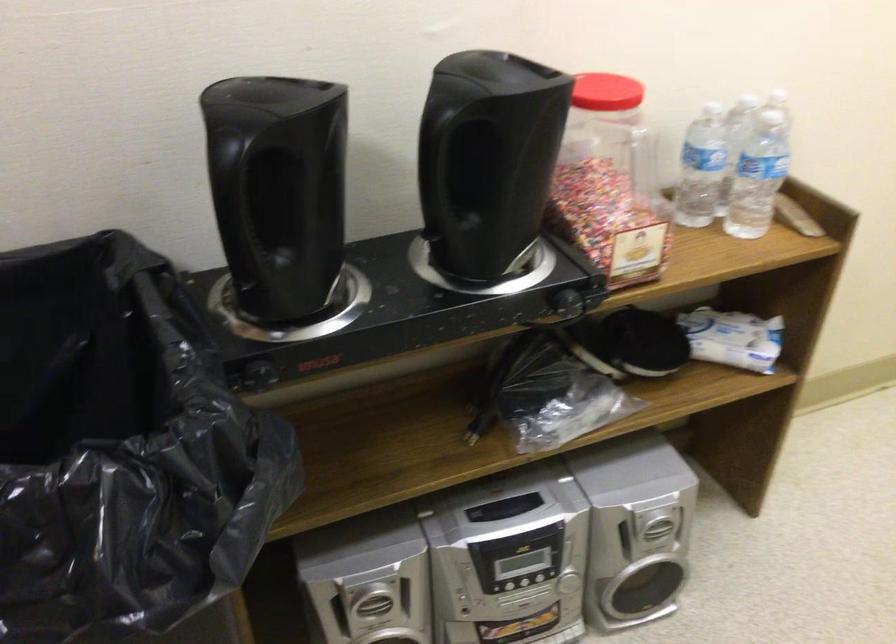
Find where to twist the red jar lid. Please return your answer as a coordinate pair (x, y).

(606, 91)